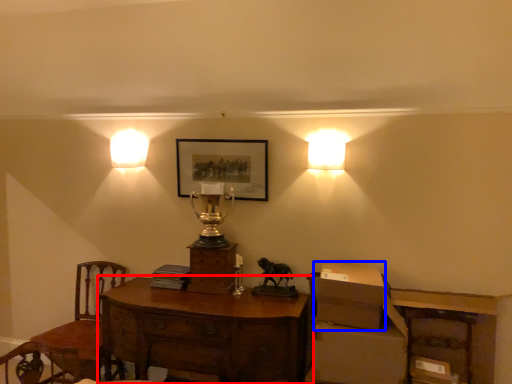
Question: Which of the following is the closest to the observer, desk (highlighted by a red box) or cardboard box (highlighted by a blue box)?

Choices:
 (A) desk
 (B) cardboard box

Answer: (A)